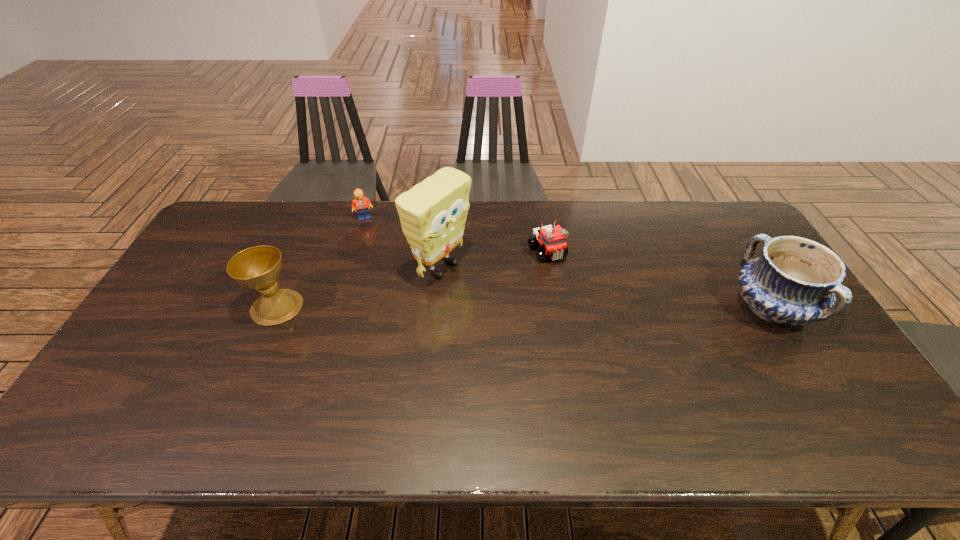
Locate an element on the screen. The height and width of the screenshot is (540, 960). free space that is in between the leftmost object and the right Lego is located at coordinates (x=412, y=279).

You are a GUI agent. You are given a task and a screenshot of the screen. Output one action in this format:
    pyautogui.click(x=<x>, y=<y>)
    Task: Click on the free space between the fourth object from right to left and the chalice
    The width and height of the screenshot is (960, 540).
    Given the screenshot: What is the action you would take?
    pyautogui.click(x=321, y=262)

Locate an element on the screen. The height and width of the screenshot is (540, 960). free space between the farther Lego and the leftmost object is located at coordinates (321, 262).

At what (x,y) coordinates should I click in order to perform the action: click on unoccupied area between the leftmost object and the farther Lego. Please return your answer as a coordinate pair (x, y). Image resolution: width=960 pixels, height=540 pixels. Looking at the image, I should click on (321, 262).

You are a GUI agent. You are given a task and a screenshot of the screen. Output one action in this format:
    pyautogui.click(x=<x>, y=<y>)
    Task: Click on the free space between the second object from right to left and the sponge
    
    Given the screenshot: What is the action you would take?
    pyautogui.click(x=494, y=260)

This screenshot has height=540, width=960. Find the location of `free space between the tallest object and the farther Lego`. free space between the tallest object and the farther Lego is located at coordinates click(402, 243).

Locate which object is the fourth closest to the second object from left to right. Please provide its 2D coordinates. Your answer should be formatted as a tuple, i.e. [(x, y)], where the tuple contains the x and y coordinates of a point satisfying the conditions above.

[(794, 281)]

Where is `object that is the closest to the second object from left to right`? object that is the closest to the second object from left to right is located at coordinates (433, 213).

This screenshot has height=540, width=960. I want to click on free spot that satisfies the following two spatial constraints: 1. on the back side of the chalice; 2. on the right side of the right Lego, so click(x=300, y=252).